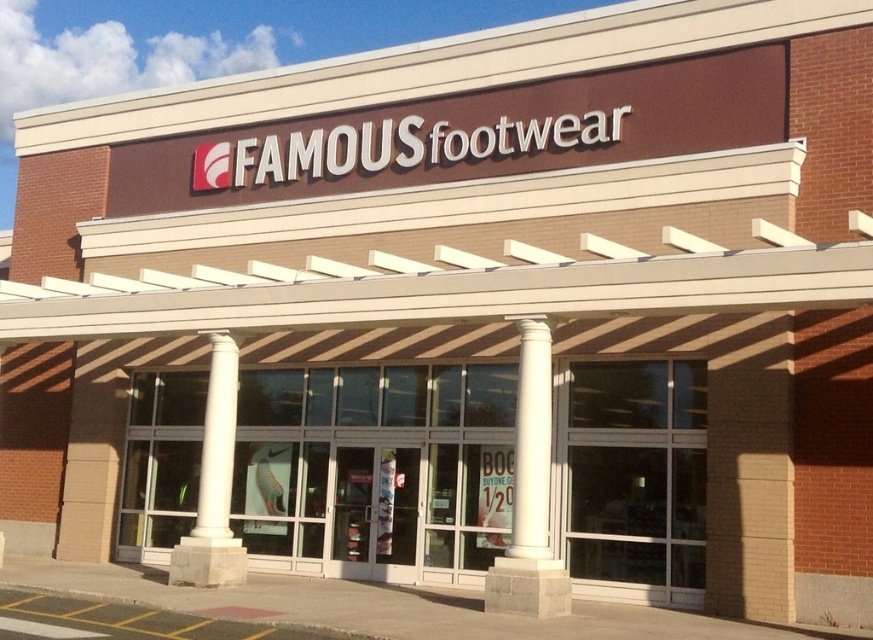
Question: In this image, where is white concrete column at center located relative to white marble column at center?

Choices:
 (A) left
 (B) right

Answer: (B)

Question: Which object is farther from the camera taking this photo?

Choices:
 (A) white concrete column at center
 (B) white marble column at center

Answer: (B)

Question: Is white concrete column at center wider than white marble column at center?

Choices:
 (A) no
 (B) yes

Answer: (A)

Question: Which point is farther from the camera taking this photo?

Choices:
 (A) (531, 508)
 (B) (214, 449)

Answer: (B)

Question: Which point is closer to the camera?

Choices:
 (A) white marble column at center
 (B) white concrete column at center

Answer: (B)

Question: Is white concrete column at center smaller than white marble column at center?

Choices:
 (A) yes
 (B) no

Answer: (B)